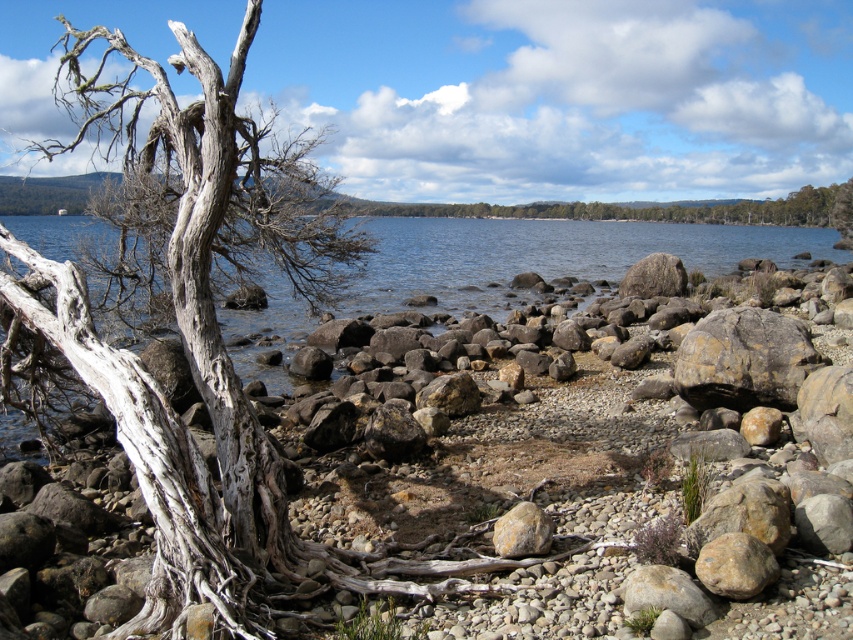
Locate an element on the screen. The image size is (853, 640). rusty metallic rock at center-right is located at coordinates (744, 358).

Is rusty metallic rock at center-right bigger than gray rough rock at lower right?

Correct, rusty metallic rock at center-right is larger in size than gray rough rock at lower right.

Who is more forward, (695,352) or (653,595)?

Point (653,595)

Where is `rusty metallic rock at center-right`? The width and height of the screenshot is (853, 640). rusty metallic rock at center-right is located at coordinates (744, 358).

Is gray rough rock at lower right further to the viewer compared to yellowish rock at center?

No, gray rough rock at lower right is in front of yellowish rock at center.

Is gray rough rock at lower right to the left of yellowish rock at center from the viewer's perspective?

No, gray rough rock at lower right is not to the left of yellowish rock at center.

Does point (635, 572) come farther from viewer compared to point (512, 552)?

No, (635, 572) is closer to viewer.

At what (x,y) coordinates should I click in order to perform the action: click on gray rough rock at lower right. Please return your answer as a coordinate pair (x, y). Looking at the image, I should click on (666, 593).

Who is more distant from viewer, (761,332) or (506,538)?

The point (761,332) is behind.

Image resolution: width=853 pixels, height=640 pixels. What do you see at coordinates (744, 358) in the screenshot?
I see `rusty metallic rock at center-right` at bounding box center [744, 358].

This screenshot has width=853, height=640. Identify the location of rusty metallic rock at center-right. (744, 358).

Locate an element on the screen. rusty metallic rock at center-right is located at coordinates (744, 358).